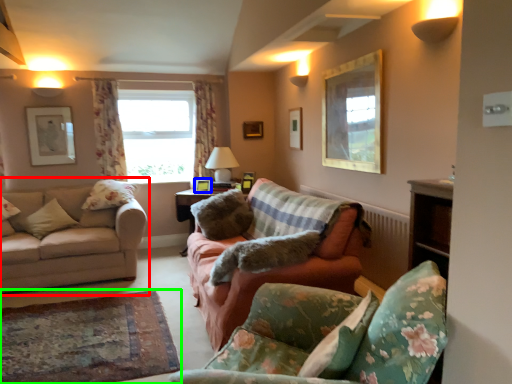
Question: Which is nearer to the studio couch (highlighted by a red box)? picture frame (highlighted by a blue box) or plain (highlighted by a green box).

Choices:
 (A) picture frame
 (B) plain

Answer: (B)